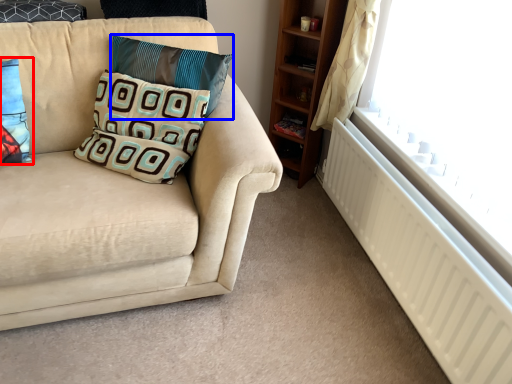
Question: Among these objects, which one is farthest to the camera, pillow (highlighted by a red box) or pillow (highlighted by a blue box)?

Choices:
 (A) pillow
 (B) pillow

Answer: (B)